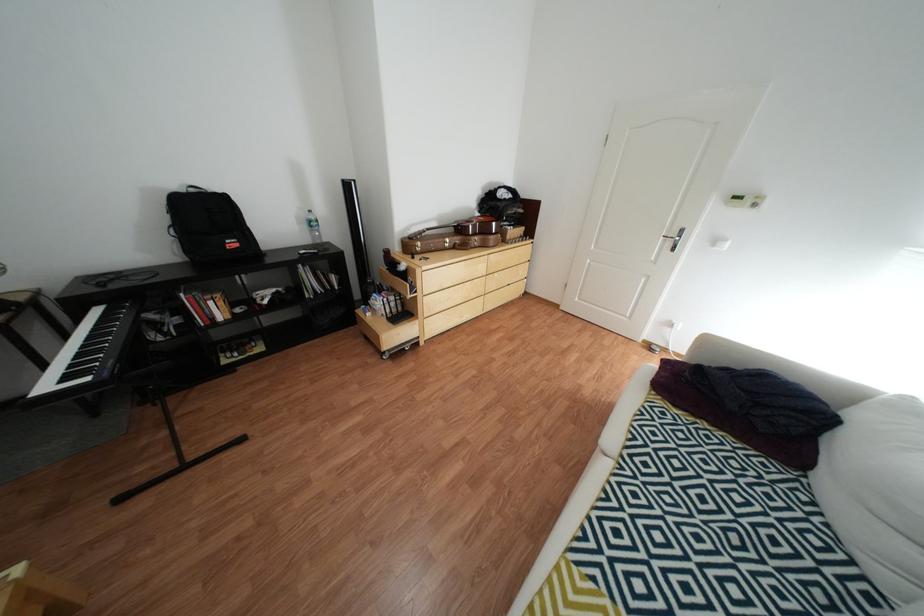
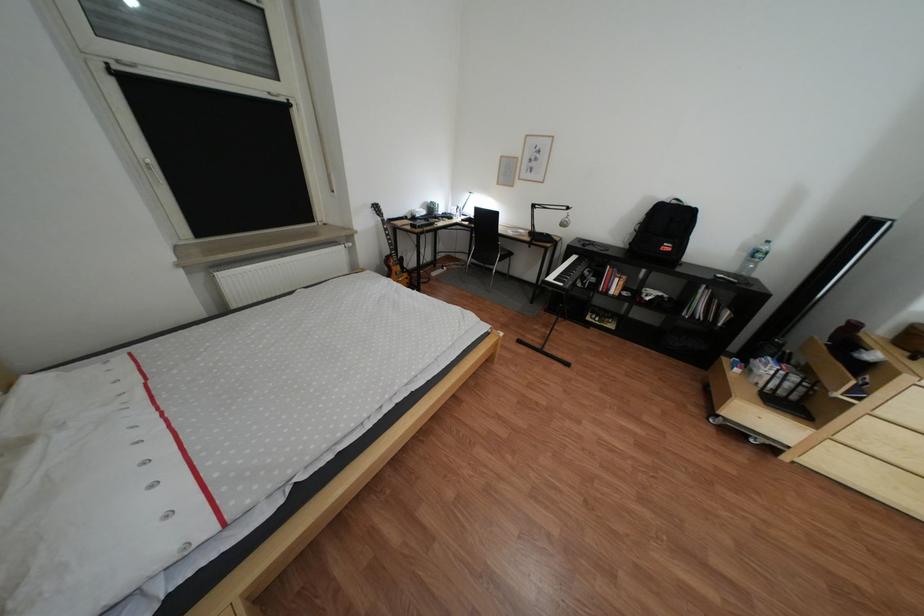
Where in the second image is the point corresponding to pixel 94 357 from the first image?

(578, 274)